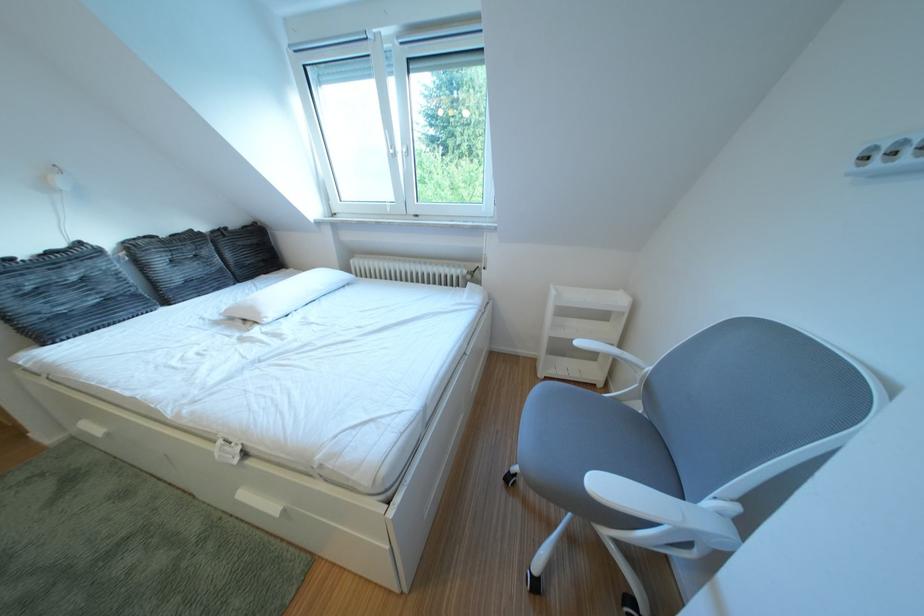
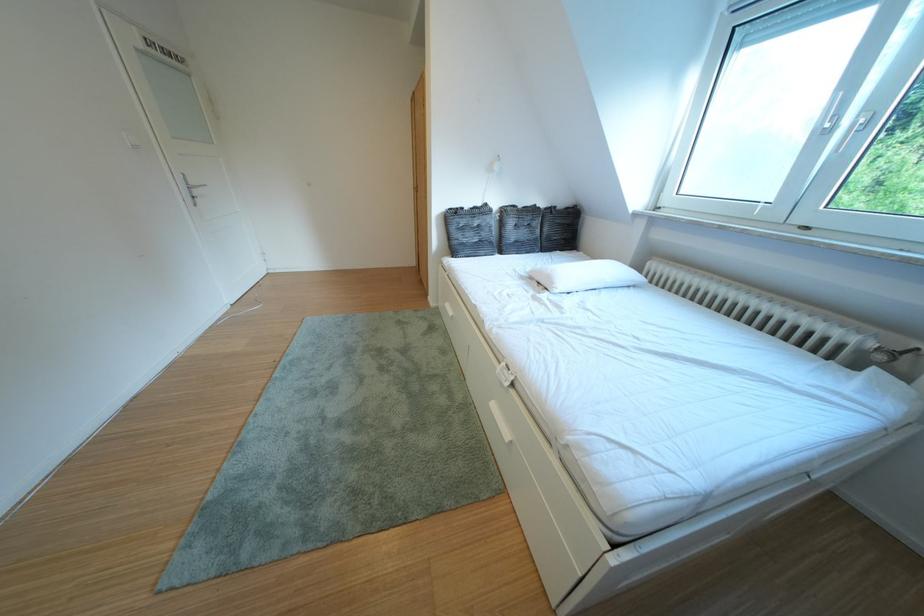
Where in the second image is the point corresponding to point 482,282 from the first image?

(893, 363)